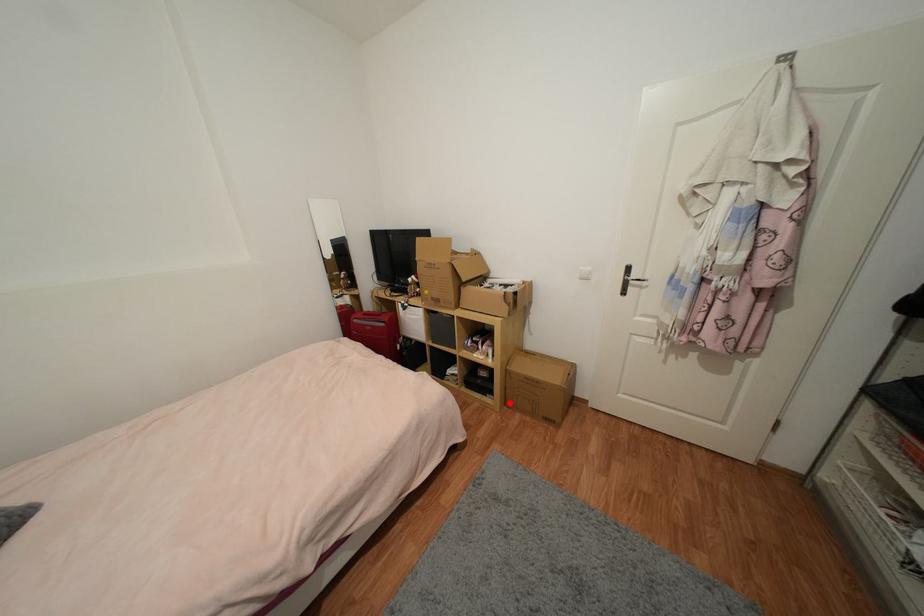
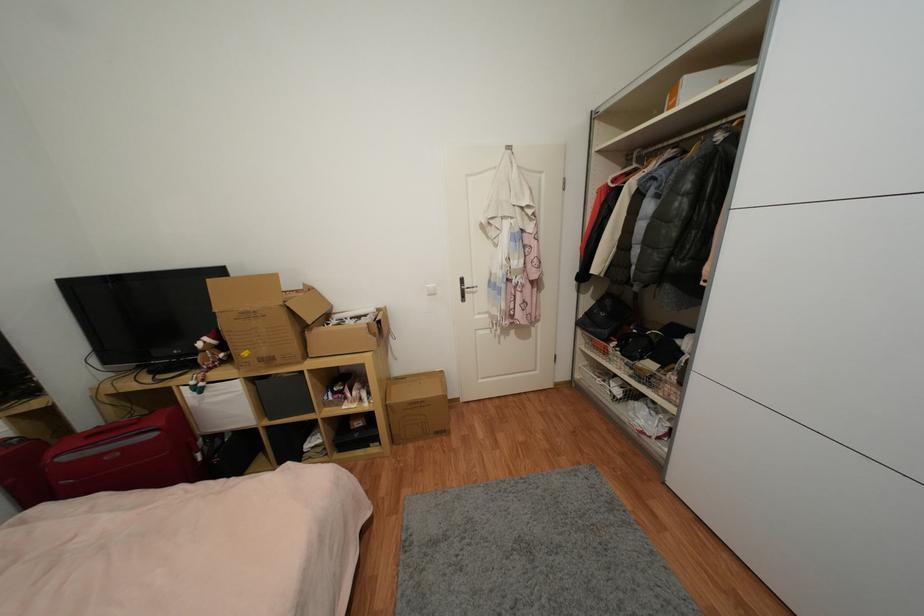
Where in the second image is the point corresponding to the highlighted location from the first image?

(397, 440)